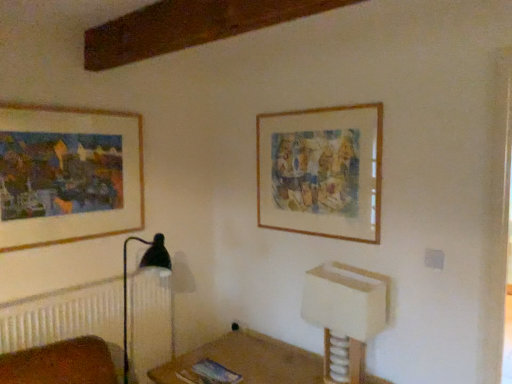
Locate an element on the screen. The width and height of the screenshot is (512, 384). white plastic vanity at lower right is located at coordinates (345, 316).

You are a GUI agent. You are given a task and a screenshot of the screen. Output one action in this format:
    pyautogui.click(x=<x>, y=<y>)
    Task: Click on the wooden frame at upper right, arranged as the 1th picture frame when viewed from the right
    The image size is (512, 384).
    Given the screenshot: What is the action you would take?
    pyautogui.click(x=321, y=171)

Which is further, (333, 325) or (60, 136)?

The point (60, 136) is farther from the camera.

Which object is wider, white plastic vanity at lower right or wooden picture frame at upper left, which appears as the 2th picture frame when viewed from the right?

Wider between the two is white plastic vanity at lower right.

Find the location of a particular element. The width and height of the screenshot is (512, 384). vanity in front of the wooden picture frame at upper left, arranged as the first picture frame when viewed from the left is located at coordinates (345, 316).

Can you confirm if wooden picture frame at upper left, arranged as the first picture frame when viewed from the left, is thinner than wooden frame at upper right, arranged as the 1th picture frame when viewed from the right?

In fact, wooden picture frame at upper left, arranged as the first picture frame when viewed from the left, might be wider than wooden frame at upper right, arranged as the 1th picture frame when viewed from the right.

In order to click on picture frame below the wooden picture frame at upper left, arranged as the first picture frame when viewed from the left (from a real-world perspective) in this screenshot , I will do `click(321, 171)`.

Is wooden picture frame at upper left, arranged as the first picture frame when viewed from the left, in front of wooden frame at upper right, arranged as the 2th picture frame when viewed from the left?

Yes, wooden picture frame at upper left, arranged as the first picture frame when viewed from the left, is closer to the camera.

Is white plastic vanity at lower right placed right next to wooden frame at upper right, arranged as the 2th picture frame when viewed from the left?

No, white plastic vanity at lower right is not in contact with wooden frame at upper right, arranged as the 2th picture frame when viewed from the left.

From the image's perspective, would you say white plastic vanity at lower right is positioned over wooden frame at upper right, arranged as the 1th picture frame when viewed from the right?

No, from the image's perspective, white plastic vanity at lower right is not on top of wooden frame at upper right, arranged as the 1th picture frame when viewed from the right.

Is wooden frame at upper right, arranged as the 2th picture frame when viewed from the left, completely or partially outside of wooden picture frame at upper left, arranged as the first picture frame when viewed from the left?

Yes, wooden frame at upper right, arranged as the 2th picture frame when viewed from the left, is not within wooden picture frame at upper left, arranged as the first picture frame when viewed from the left.

Considering the relative sizes of wooden frame at upper right, arranged as the 2th picture frame when viewed from the left, and wooden picture frame at upper left, arranged as the first picture frame when viewed from the left, in the image provided, is wooden frame at upper right, arranged as the 2th picture frame when viewed from the left, wider than wooden picture frame at upper left, arranged as the first picture frame when viewed from the left,?

Incorrect, the width of wooden frame at upper right, arranged as the 2th picture frame when viewed from the left, does not surpass that of wooden picture frame at upper left, arranged as the first picture frame when viewed from the left.

Considering the relative positions of wooden frame at upper right, arranged as the 2th picture frame when viewed from the left, and wooden picture frame at upper left, which appears as the 2th picture frame when viewed from the right, in the image provided, is wooden frame at upper right, arranged as the 2th picture frame when viewed from the left, behind wooden picture frame at upper left, which appears as the 2th picture frame when viewed from the right,?

Yes.

From the image's perspective, is wooden frame at upper right, arranged as the 1th picture frame when viewed from the right, on top of wooden picture frame at upper left, arranged as the first picture frame when viewed from the left?

Yes, from the image's perspective, wooden frame at upper right, arranged as the 1th picture frame when viewed from the right, is on top of wooden picture frame at upper left, arranged as the first picture frame when viewed from the left.

Between point (1, 241) and point (336, 377), which one is positioned in front?

The point (1, 241) is more forward.

How different are the orientations of wooden picture frame at upper left, which appears as the 2th picture frame when viewed from the right, and white plastic vanity at lower right in degrees?

The facing directions of wooden picture frame at upper left, which appears as the 2th picture frame when viewed from the right, and white plastic vanity at lower right are 90.8 degrees apart.

In terms of width, does wooden picture frame at upper left, arranged as the first picture frame when viewed from the left, look wider or thinner when compared to white plastic vanity at lower right?

Considering their sizes, wooden picture frame at upper left, arranged as the first picture frame when viewed from the left, looks slimmer than white plastic vanity at lower right.

Which of these two, wooden picture frame at upper left, arranged as the first picture frame when viewed from the left, or white plastic vanity at lower right, is smaller?

Smaller between the two is wooden picture frame at upper left, arranged as the first picture frame when viewed from the left.

Which of these two, wooden frame at upper right, arranged as the 2th picture frame when viewed from the left, or white plastic vanity at lower right, stands shorter?

Standing shorter between the two is white plastic vanity at lower right.

In the scene shown: Is wooden frame at upper right, arranged as the 1th picture frame when viewed from the right, beside white plastic vanity at lower right?

No.

Measure the distance from wooden frame at upper right, arranged as the 2th picture frame when viewed from the left, to white plastic vanity at lower right.

47.78 centimeters.

Do you think wooden frame at upper right, arranged as the 2th picture frame when viewed from the left, is within white plastic vanity at lower right, or outside of it?

wooden frame at upper right, arranged as the 2th picture frame when viewed from the left, is spatially situated outside white plastic vanity at lower right.

Identify the location of vanity in front of the wooden picture frame at upper left, arranged as the first picture frame when viewed from the left. This screenshot has width=512, height=384. (345, 316).

The width and height of the screenshot is (512, 384). I want to click on picture frame below the wooden picture frame at upper left, arranged as the first picture frame when viewed from the left (from a real-world perspective), so click(321, 171).

Which object lies nearer to the anchor point wooden frame at upper right, arranged as the 2th picture frame when viewed from the left, wooden picture frame at upper left, arranged as the first picture frame when viewed from the left, or white plastic vanity at lower right?

white plastic vanity at lower right is positioned closer to the anchor wooden frame at upper right, arranged as the 2th picture frame when viewed from the left.

When comparing their distances from wooden frame at upper right, arranged as the 2th picture frame when viewed from the left, does white plastic vanity at lower right or wooden picture frame at upper left, arranged as the first picture frame when viewed from the left, seem closer?

white plastic vanity at lower right is positioned closer to the anchor wooden frame at upper right, arranged as the 2th picture frame when viewed from the left.

Which object lies further to the anchor point white plastic vanity at lower right, wooden frame at upper right, arranged as the 2th picture frame when viewed from the left, or wooden picture frame at upper left, which appears as the 2th picture frame when viewed from the right?

wooden picture frame at upper left, which appears as the 2th picture frame when viewed from the right, is further to white plastic vanity at lower right.

Which object lies further to the anchor point wooden picture frame at upper left, arranged as the first picture frame when viewed from the left, white plastic vanity at lower right or wooden frame at upper right, arranged as the 1th picture frame when viewed from the right?

The object further to wooden picture frame at upper left, arranged as the first picture frame when viewed from the left, is white plastic vanity at lower right.

Which object lies further to the anchor point wooden picture frame at upper left, which appears as the 2th picture frame when viewed from the right, wooden frame at upper right, arranged as the 1th picture frame when viewed from the right, or white plastic vanity at lower right?

white plastic vanity at lower right is further to wooden picture frame at upper left, which appears as the 2th picture frame when viewed from the right.

From the image, which object appears to be nearer to white plastic vanity at lower right, wooden picture frame at upper left, arranged as the first picture frame when viewed from the left, or wooden frame at upper right, arranged as the 1th picture frame when viewed from the right?

Based on the image, wooden frame at upper right, arranged as the 1th picture frame when viewed from the right, appears to be nearer to white plastic vanity at lower right.

You are a GUI agent. You are given a task and a screenshot of the screen. Output one action in this format:
    pyautogui.click(x=<x>, y=<y>)
    Task: Click on the picture frame between wooden picture frame at upper left, which appears as the 2th picture frame when viewed from the right, and white plastic vanity at lower right from left to right
    The height and width of the screenshot is (384, 512).
    Given the screenshot: What is the action you would take?
    pyautogui.click(x=321, y=171)